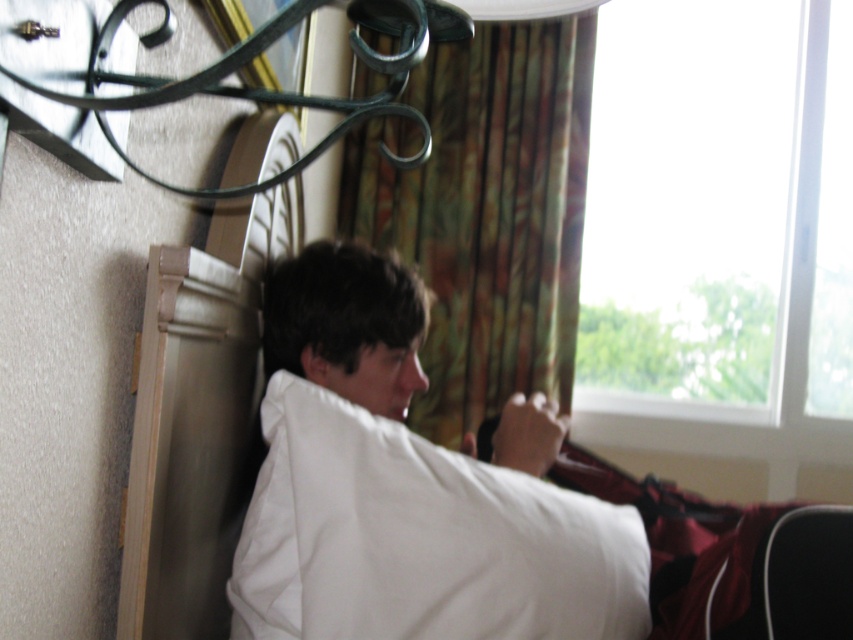
Does transparent glass window at upper right have a lesser height compared to white soft pillow at center?

Incorrect, transparent glass window at upper right's height does not fall short of white soft pillow at center's.

Is the position of transparent glass window at upper right more distant than that of white soft pillow at center?

Yes, it is.

This screenshot has height=640, width=853. What do you see at coordinates (718, 211) in the screenshot?
I see `transparent glass window at upper right` at bounding box center [718, 211].

Locate an element on the screen. The height and width of the screenshot is (640, 853). transparent glass window at upper right is located at coordinates (718, 211).

Does white soft pillow at center appear over multicolored fabric curtain at center?

Incorrect, white soft pillow at center is not positioned above multicolored fabric curtain at center.

Does point (503, 508) come farther from viewer compared to point (579, 182)?

No, it is not.

At what (x,y) coordinates should I click in order to perform the action: click on white soft pillow at center. Please return your answer as a coordinate pair (x, y). This screenshot has width=853, height=640. Looking at the image, I should click on (421, 540).

Does point (691, 36) lie in front of point (454, 182)?

No, it is not.

Is transparent glass window at upper right above multicolored fabric curtain at center?

Yes.

Find the location of `transparent glass window at upper right`. transparent glass window at upper right is located at coordinates (x=718, y=211).